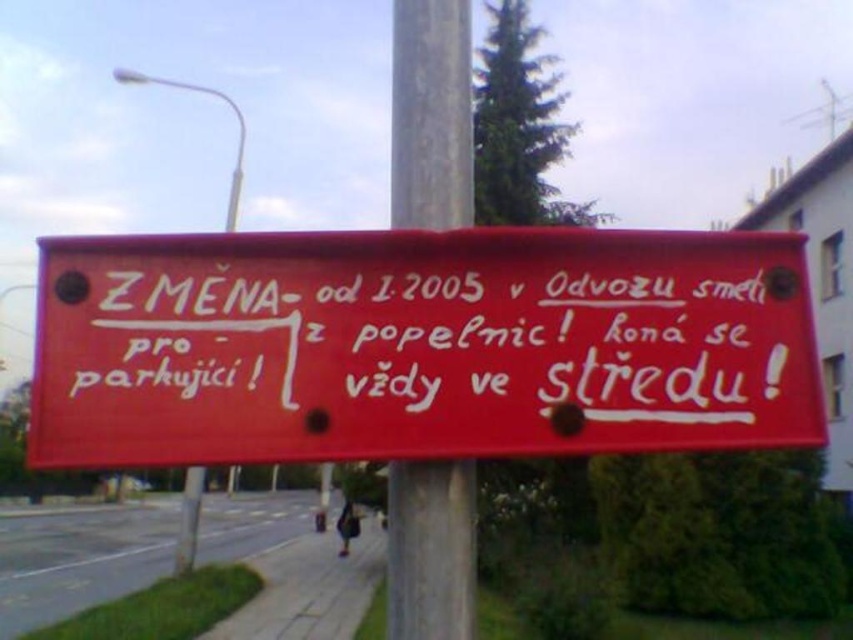
Can you confirm if matte red sign at center is positioned above smooth gray pole at center?

Yes, matte red sign at center is above smooth gray pole at center.

Does matte red sign at center lie behind smooth gray pole at center?

No, it is in front of smooth gray pole at center.

Which is behind, point (355, 307) or point (393, 486)?

The point (393, 486) is behind.

This screenshot has height=640, width=853. I want to click on matte red sign at center, so click(x=419, y=346).

Is point (207, 372) positioned after point (187, 476)?

No.

Is matte red sign at center shorter than metallic pole at center?

Yes.

Locate an element on the screen. This screenshot has width=853, height=640. matte red sign at center is located at coordinates (419, 346).

Is smooth gray pole at center positioned in front of metallic pole at center?

No, smooth gray pole at center is further to the viewer.

Based on the photo, does smooth gray pole at center have a greater height compared to metallic pole at center?

Incorrect, smooth gray pole at center's height is not larger of metallic pole at center's.

Between point (466, 68) and point (189, 570), which one is positioned behind?

The point (189, 570) is behind.

Where is `smooth gray pole at center`? The height and width of the screenshot is (640, 853). smooth gray pole at center is located at coordinates (431, 115).